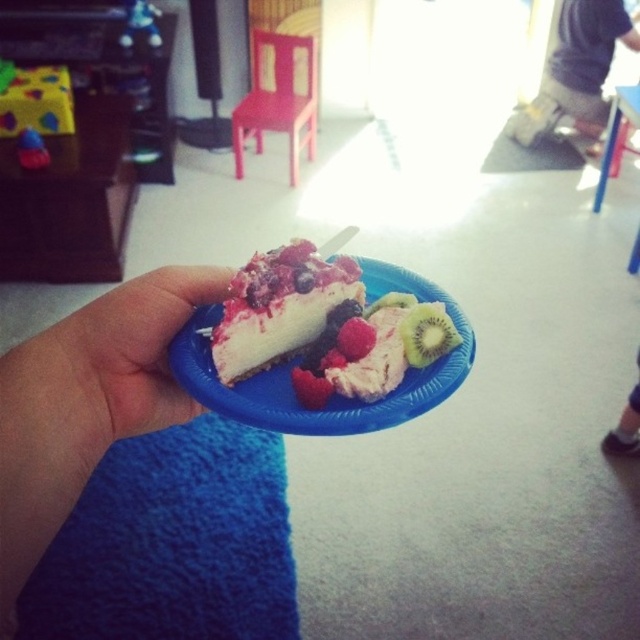
Question: In this image, where is green matte kiwi at center located relative to green textured kiwi at center?

Choices:
 (A) above
 (B) below

Answer: (B)

Question: Does blue plastic plate at center have a greater width compared to white creamy cheesecake at center?

Choices:
 (A) no
 (B) yes

Answer: (B)

Question: Which point is farther from the camera taking this photo?

Choices:
 (A) (349, 349)
 (B) (392, 305)
 (C) (401, 381)

Answer: (B)

Question: Is green matte kiwi at center below raspberry matte at center?

Choices:
 (A) no
 (B) yes

Answer: (A)

Question: Which of the following is the farthest from the observer?

Choices:
 (A) (300, 401)
 (B) (413, 403)

Answer: (A)

Question: Which point appears closest to the camera in this image?

Choices:
 (A) [307, 323]
 (B) [161, 416]
 (C) [385, 305]
 (D) [435, 317]

Answer: (B)